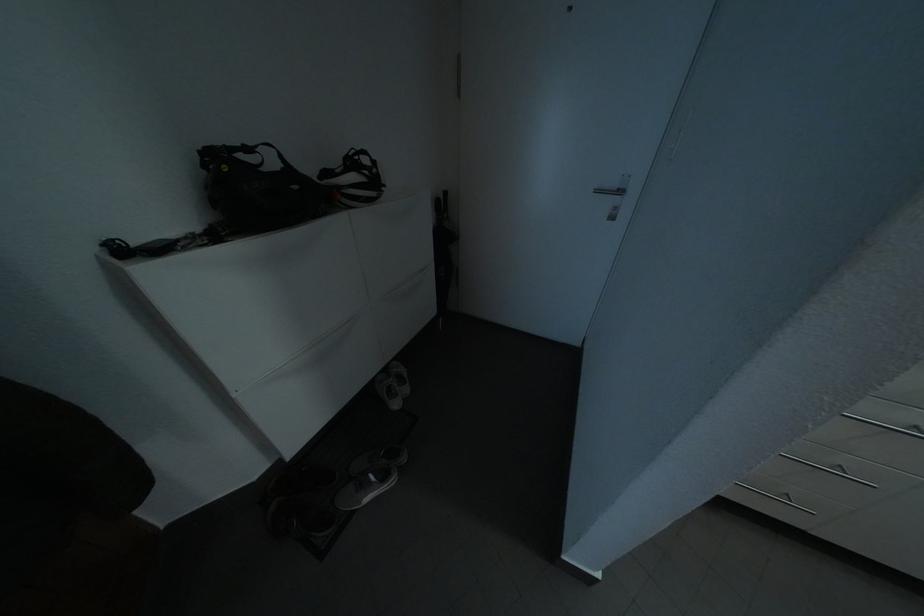
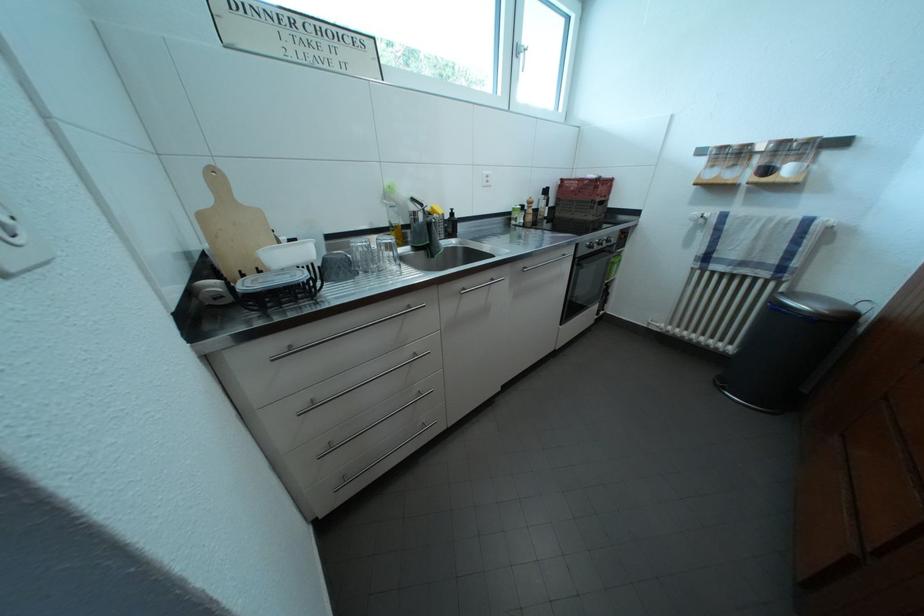
Question: The camera is either moving clockwise (left) or counter-clockwise (right) around the object. The first image is from the beginning of the video and the second image is from the end. Is the camera moving left or right when shooting the video?

Choices:
 (A) Left
 (B) Right

Answer: (A)